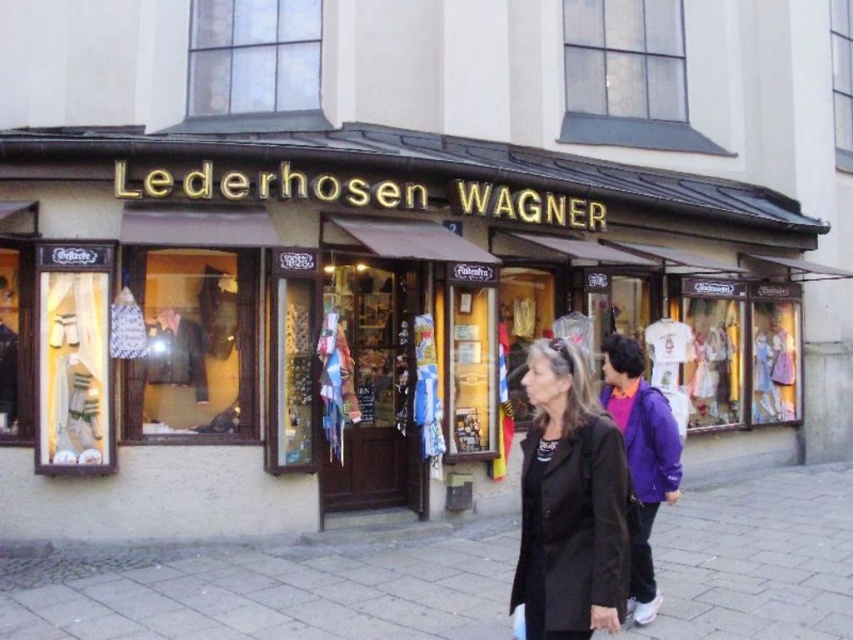
Between matte black sign at center and gray stone pavement at lower center, which one appears on the right side from the viewer's perspective?

matte black sign at center

Between matte black sign at center and gray stone pavement at lower center, which one is positioned lower?

Positioned lower is gray stone pavement at lower center.

Who is more distant from viewer, (102, 172) or (833, 557)?

Point (102, 172)

Where is `matte black sign at center`? Image resolution: width=853 pixels, height=640 pixels. matte black sign at center is located at coordinates [407, 292].

Measure the distance between point [843,156] and camera.

Point [843,156] is 13.94 meters away from camera.

Is point (200, 209) farther from viewer compared to point (639, 456)?

Yes, point (200, 209) is behind point (639, 456).

The image size is (853, 640). I want to click on matte black sign at center, so click(407, 292).

Between gray stone pavement at lower center and purple fleece jacket at center, which one appears on the left side from the viewer's perspective?

From the viewer's perspective, gray stone pavement at lower center appears more on the left side.

Is the position of gray stone pavement at lower center more distant than that of purple fleece jacket at center?

Yes.

Is point (679, 545) less distant than point (628, 461)?

No, it is not.

I want to click on gray stone pavement at lower center, so click(273, 593).